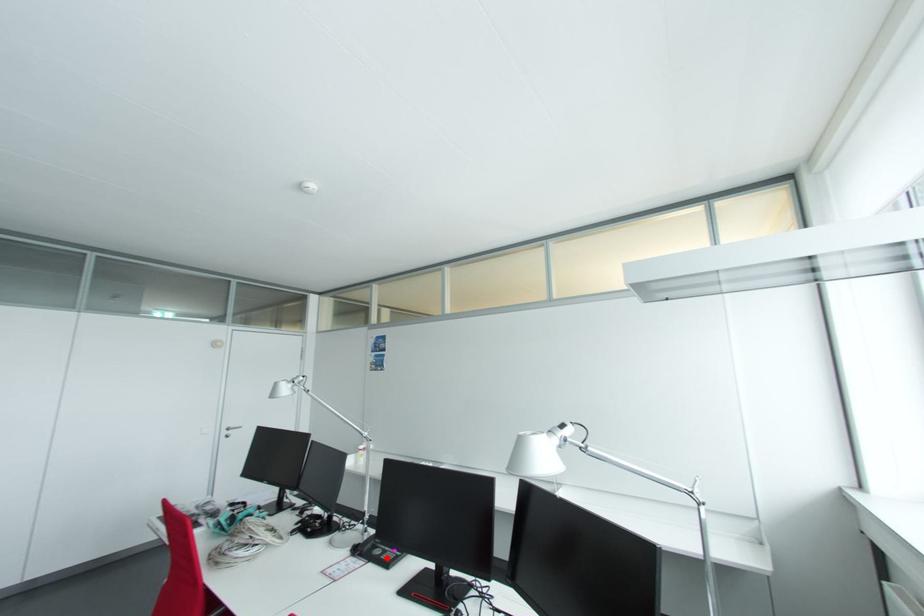
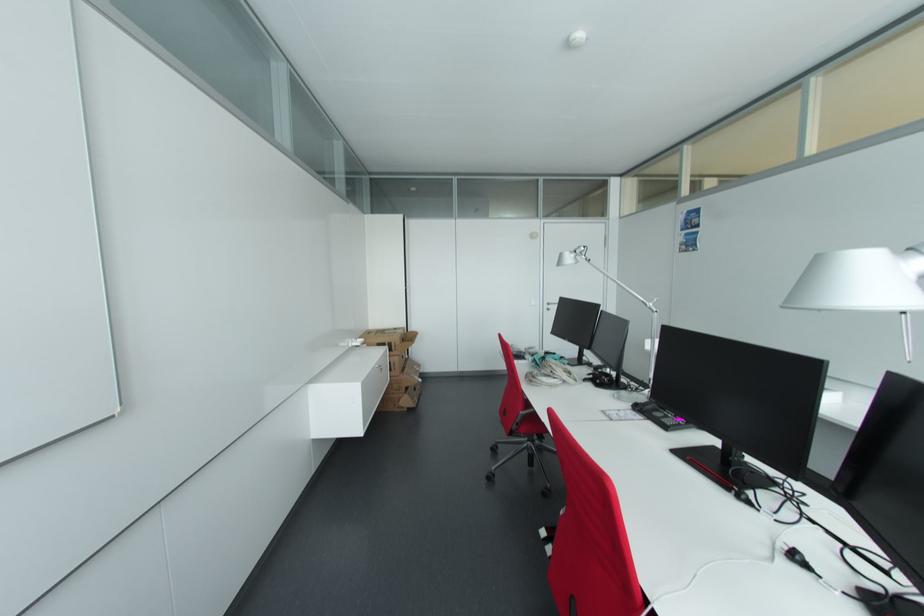
In the second image, find the point that corresponds to the highlighted location in the first image.

(666, 421)